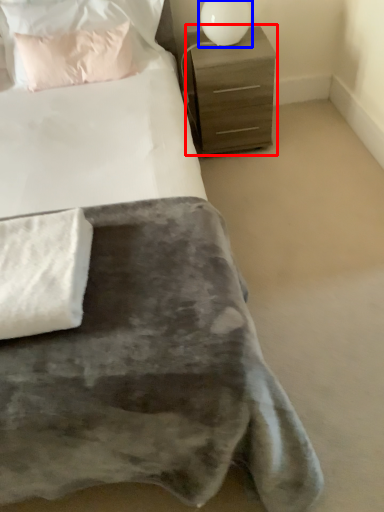
Question: Which object is further to the camera taking this photo, chest of drawers (highlighted by a red box) or table lamp (highlighted by a blue box)?

Choices:
 (A) chest of drawers
 (B) table lamp

Answer: (A)